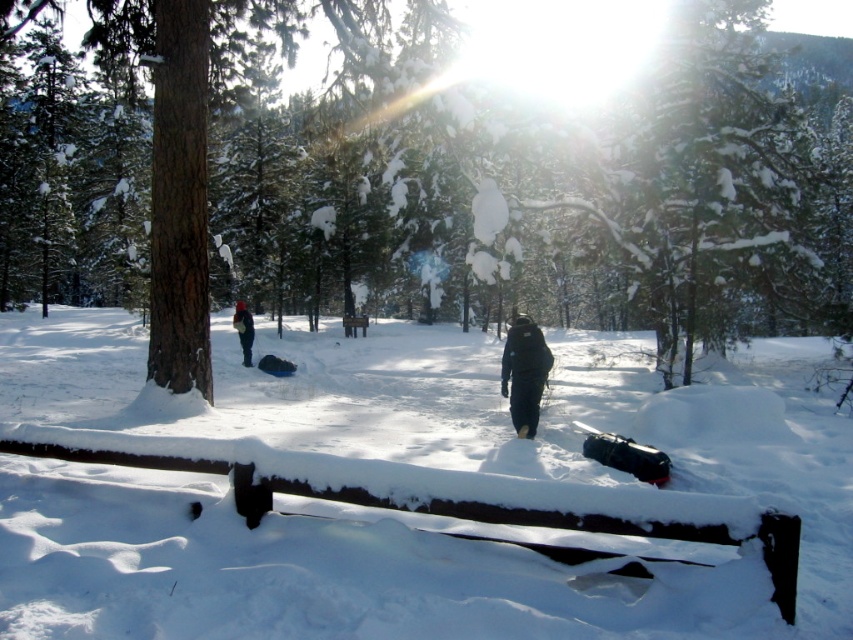
Based on the photo, is brown wood tree at center positioned in front of white fluffy snow at center?

No, brown wood tree at center is further to the viewer.

In the scene shown: Is brown wood tree at center shorter than white fluffy snow at center?

No.

The image size is (853, 640). What do you see at coordinates (416, 179) in the screenshot?
I see `brown wood tree at center` at bounding box center [416, 179].

In order to click on brown wood tree at center in this screenshot , I will do `click(416, 179)`.

Between white fluffy snow at center and black matte jacket at center, which one is positioned lower?

Positioned lower is black matte jacket at center.

The width and height of the screenshot is (853, 640). Find the location of `white fluffy snow at center`. white fluffy snow at center is located at coordinates (427, 515).

Can you confirm if brown wood tree at center is thinner than black matte jacket at center?

In fact, brown wood tree at center might be wider than black matte jacket at center.

Consider the image. Is brown wood tree at center above black matte jacket at center?

Yes, brown wood tree at center is above black matte jacket at center.

What do you see at coordinates (416, 179) in the screenshot? This screenshot has width=853, height=640. I see `brown wood tree at center` at bounding box center [416, 179].

This screenshot has width=853, height=640. What are the coordinates of `brown wood tree at center` in the screenshot? It's located at (416, 179).